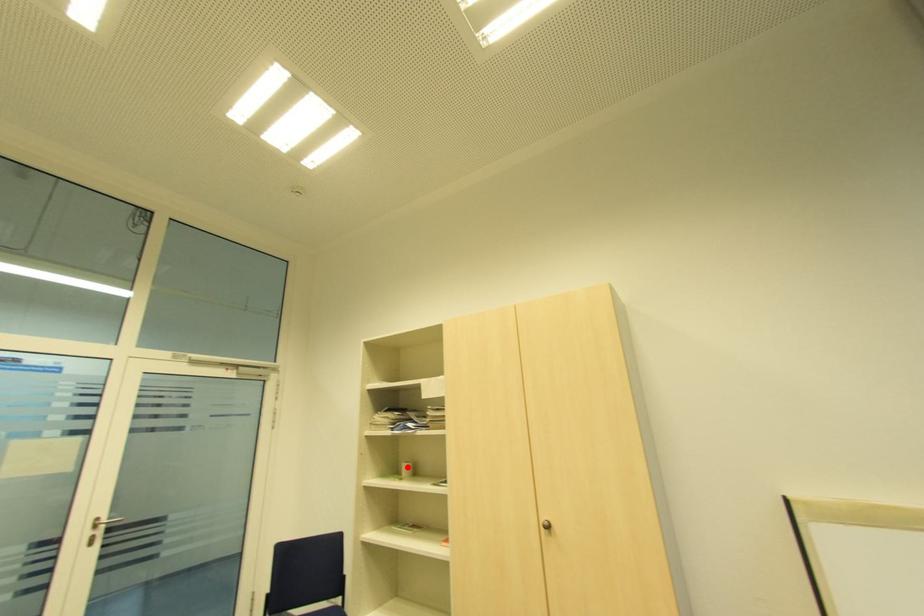
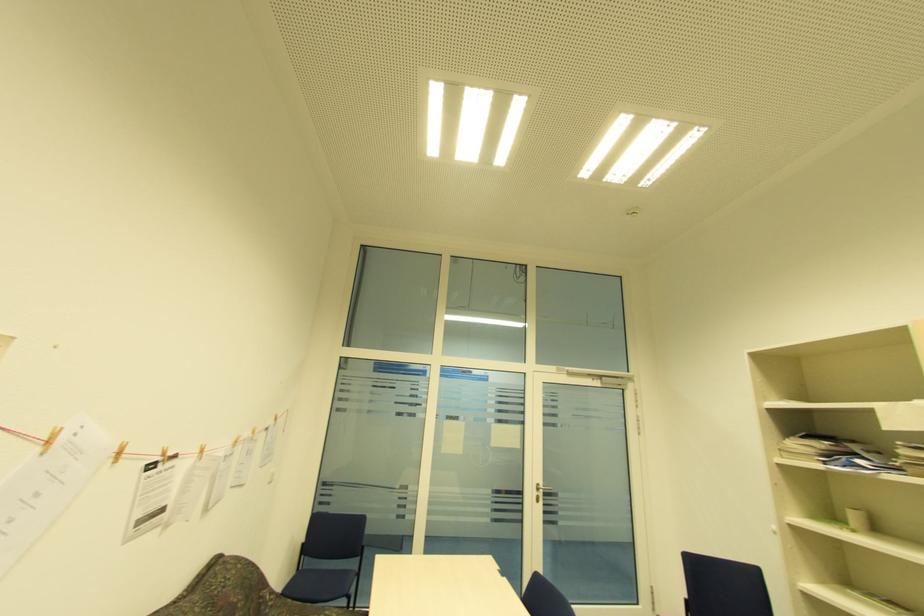
Question: I am providing you with two images of the same scene from different viewpoints. Given a red point in image1, look at the same physical point in image2. Is it:

Choices:
 (A) Closer to the viewpoint
 (B) Farther from the viewpoint

Answer: (A)